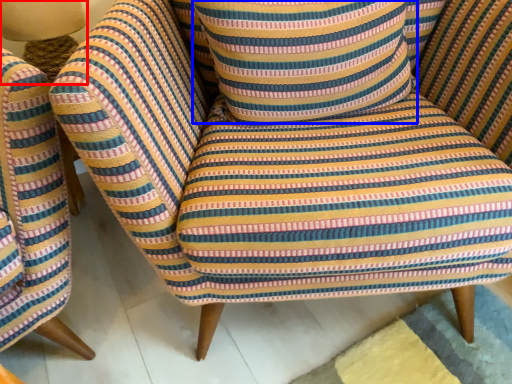
Question: Which of the following is the farthest to the observer, table lamp (highlighted by a red box) or throw pillow (highlighted by a blue box)?

Choices:
 (A) table lamp
 (B) throw pillow

Answer: (A)